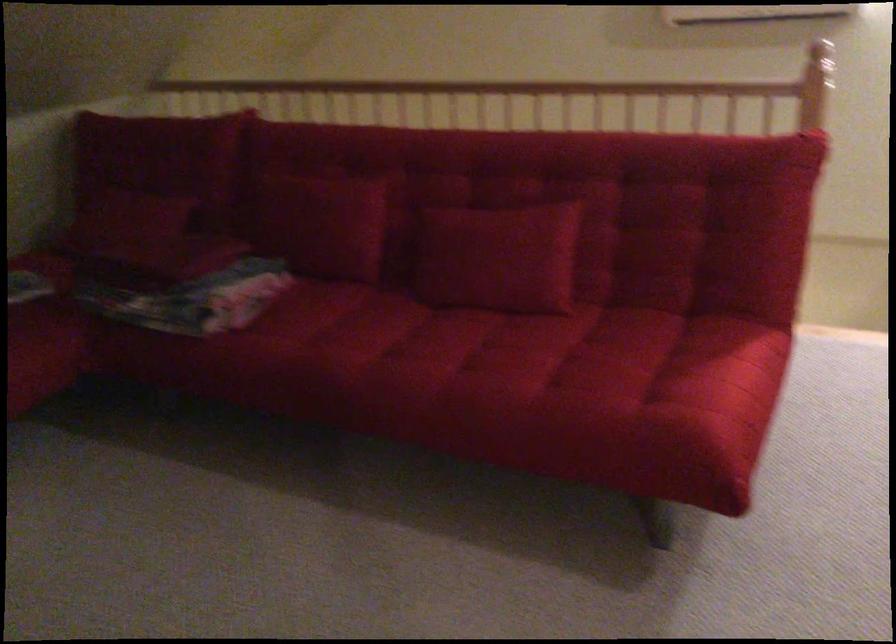
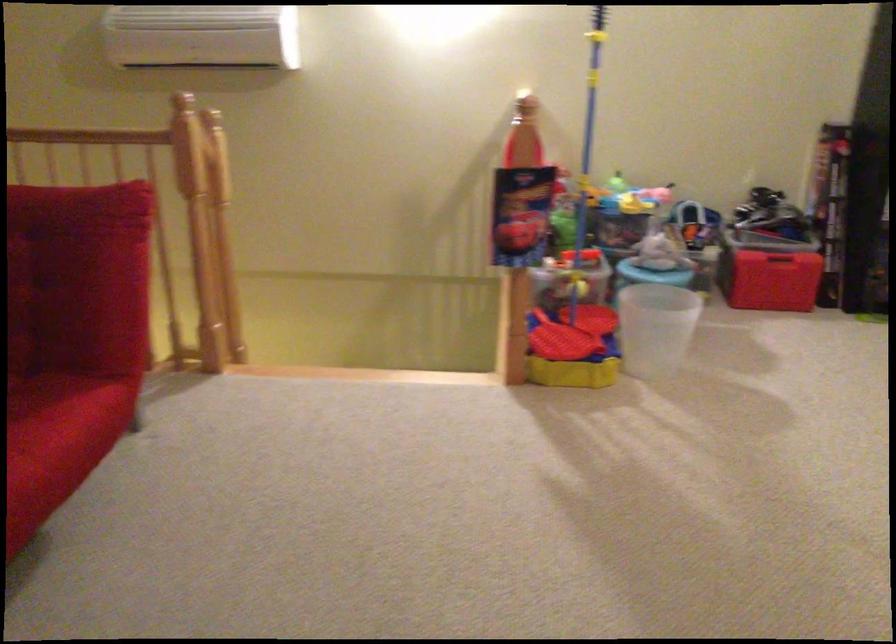
Question: Based on the continuous images, in which direction is the camera rotating? Reply with the corresponding letter.

Choices:
 (A) Left
 (B) Right
 (C) Up
 (D) Down

Answer: (B)